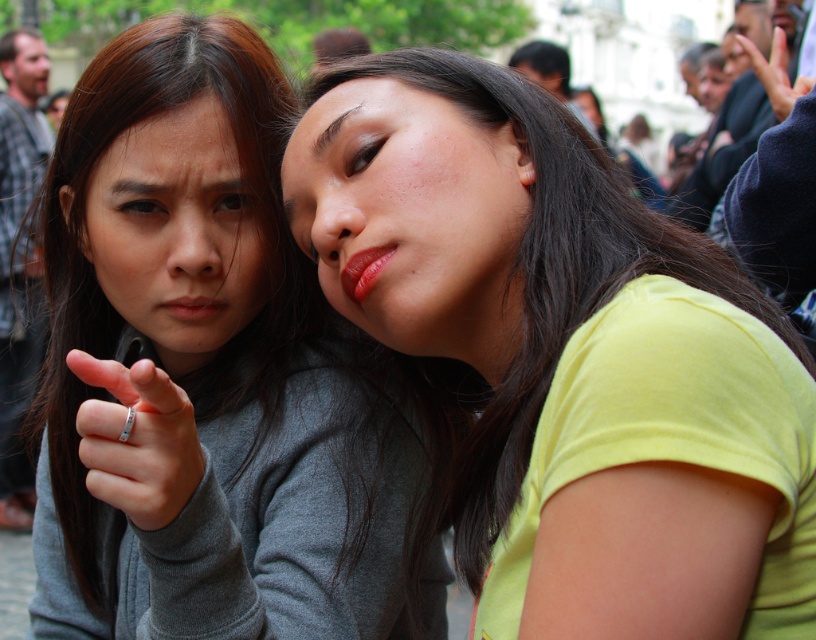
You are a makeup artist observing the two individuals in the image. You notice the matte red lipstick at center and the glossy matte lips at center. Which one is positioned more to the left?

The matte red lipstick at center is positioned more to the left than the glossy matte lips at center.

You are a photographer trying to capture a closeup shot of the gray matte sweater at left and the matte gray face at left in the image. Given that your camera can only focus on objects within 10 feet of each other, will you be able to get a clear photo of both?

The gray matte sweater at left and matte gray face at left are 11.66 feet apart from each other, which exceeds the camera focus range of 10 feet. Therefore, you cannot get a clear photo of both.